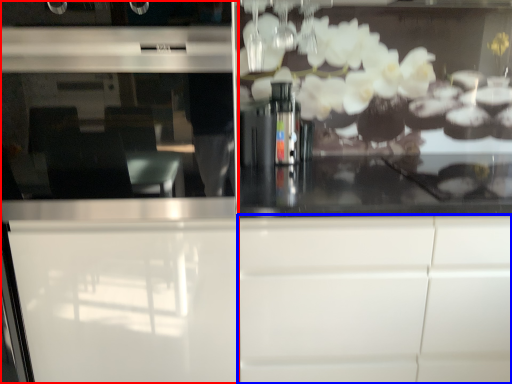
Question: Which point is closer to the camera, screen door (highlighted by a red box) or cabinetry (highlighted by a blue box)?

Choices:
 (A) screen door
 (B) cabinetry

Answer: (A)